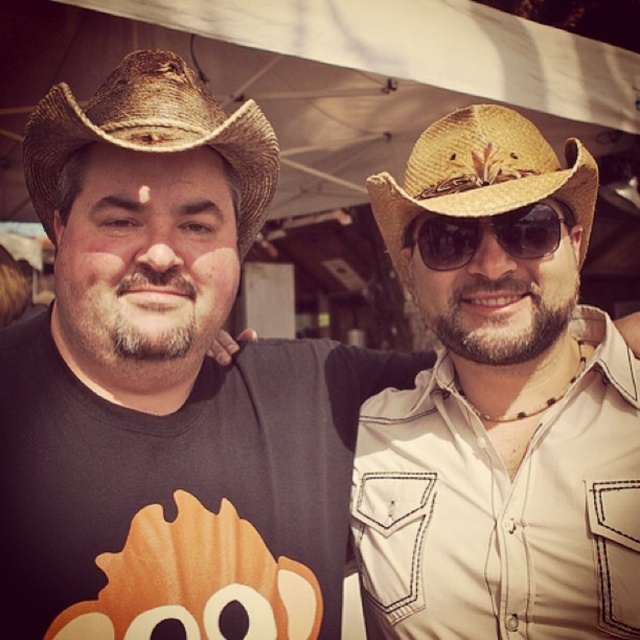
You are a photographer trying to adjust the focus on your camera. You notice two items in the frame that are important for the shot. The brown straw cowboy hat at left and the sunglasses at center. Which item is closer to the camera?

The brown straw cowboy hat at left is closer to the camera because it is only 14.88 inches away from the sunglasses at center, but without knowing the exact depth, we can infer based on their positions in the frame.

You are standing in front of the two people in the image. You want to hand a gift to the person wearing the brown straw cowboy hat at left without disturbing the person wearing the natural straw cowboy hat at center. Which hat should you approach first?

Since the brown straw cowboy hat at left is closer to the viewer than the natural straw cowboy hat at center, you should approach the brown straw cowboy hat at left first to hand the gift without disturbing the other person.